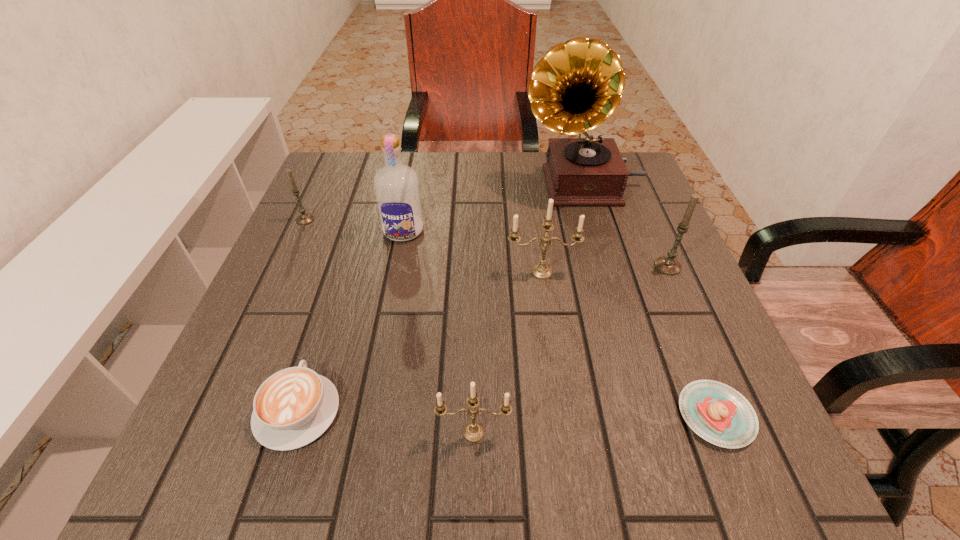
Identify the location of vacant region between the fourth object from left to right and the farthest object. This screenshot has width=960, height=540. (528, 308).

Locate an element on the screen. This screenshot has height=540, width=960. free area in between the fifth object from right to left and the rightmost candle is located at coordinates (570, 349).

You are a GUI agent. You are given a task and a screenshot of the screen. Output one action in this format:
    pyautogui.click(x=<x>, y=<y>)
    Task: Click on the vacant space that's between the left gray candle and the third object from left to right
    Image resolution: width=960 pixels, height=540 pixels.
    Given the screenshot: What is the action you would take?
    pyautogui.click(x=354, y=225)

Identify the location of free spot between the farther gray candle and the right metallic candle. The image size is (960, 540). (423, 246).

Where is `free space that is in between the farthest candle and the phonograph record`? The height and width of the screenshot is (540, 960). free space that is in between the farthest candle and the phonograph record is located at coordinates (444, 202).

The image size is (960, 540). In order to click on vacant region between the right gray candle and the second object from left to right in this screenshot , I will do `click(483, 338)`.

Where is `object that is the fourth closest one to the nearer gray candle`? This screenshot has width=960, height=540. object that is the fourth closest one to the nearer gray candle is located at coordinates (x=473, y=432).

The height and width of the screenshot is (540, 960). I want to click on object that stands as the closest to the third object from left to right, so click(x=305, y=218).

Locate which candle is the closest to the phonograph record. Please provide its 2D coordinates. Your answer should be formatted as a tuple, i.e. [(x, y)], where the tuple contains the x and y coordinates of a point satisfying the conditions above.

[(668, 265)]

Locate an element on the screen. This screenshot has height=540, width=960. the second closest candle to the farthest candle is located at coordinates (473, 432).